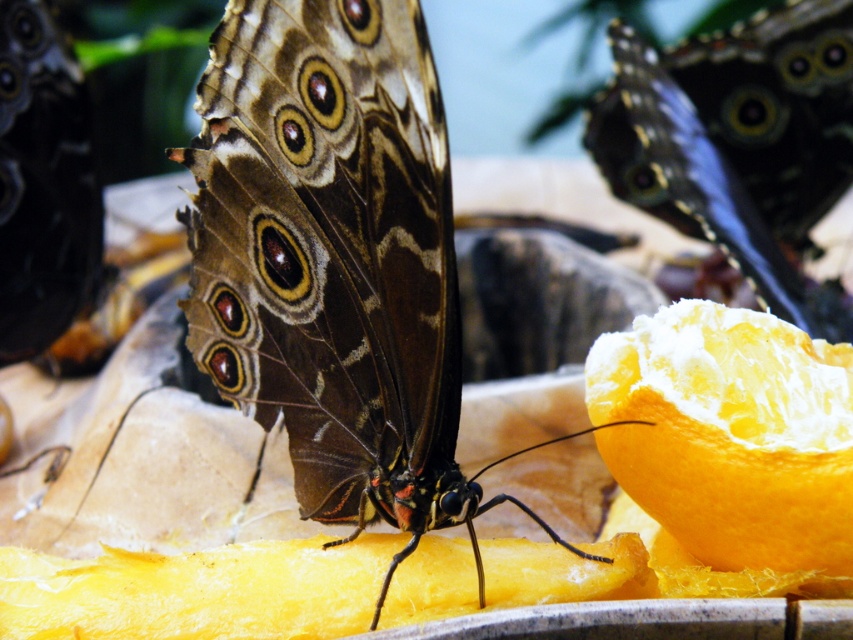
The image size is (853, 640). I want to click on smooth orange at lower right, so click(730, 435).

This screenshot has width=853, height=640. Describe the element at coordinates (730, 435) in the screenshot. I see `smooth orange at lower right` at that location.

Find the location of a particular element. The height and width of the screenshot is (640, 853). smooth orange at lower right is located at coordinates (730, 435).

Measure the distance between shiny brown butterfly at center and shiny blue butterfly at upper right.

shiny brown butterfly at center and shiny blue butterfly at upper right are 20.65 inches apart.

Can you confirm if shiny brown butterfly at center is taller than shiny blue butterfly at upper right?

Yes, shiny brown butterfly at center is taller than shiny blue butterfly at upper right.

Between point (310, 392) and point (805, 289), which one is positioned behind?

Positioned behind is point (805, 289).

Locate an element on the screen. shiny brown butterfly at center is located at coordinates (335, 260).

Between point (419, 275) and point (717, 404), which one is positioned behind?

The point (717, 404) is more distant.

Can you confirm if shiny brown butterfly at center is taller than smooth orange at lower right?

Correct, shiny brown butterfly at center is much taller as smooth orange at lower right.

Describe the element at coordinates (335, 260) in the screenshot. This screenshot has height=640, width=853. I see `shiny brown butterfly at center` at that location.

Where is `shiny brown butterfly at center`? shiny brown butterfly at center is located at coordinates (335, 260).